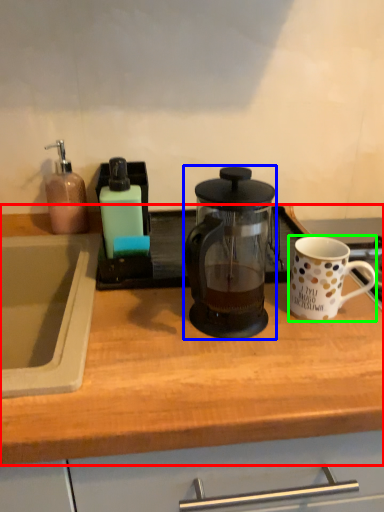
Question: Considering the real-world distances, which object is farthest from countertop (highlighted by a red box)? kettle (highlighted by a blue box) or coffee cup (highlighted by a green box)?

Choices:
 (A) kettle
 (B) coffee cup

Answer: (B)